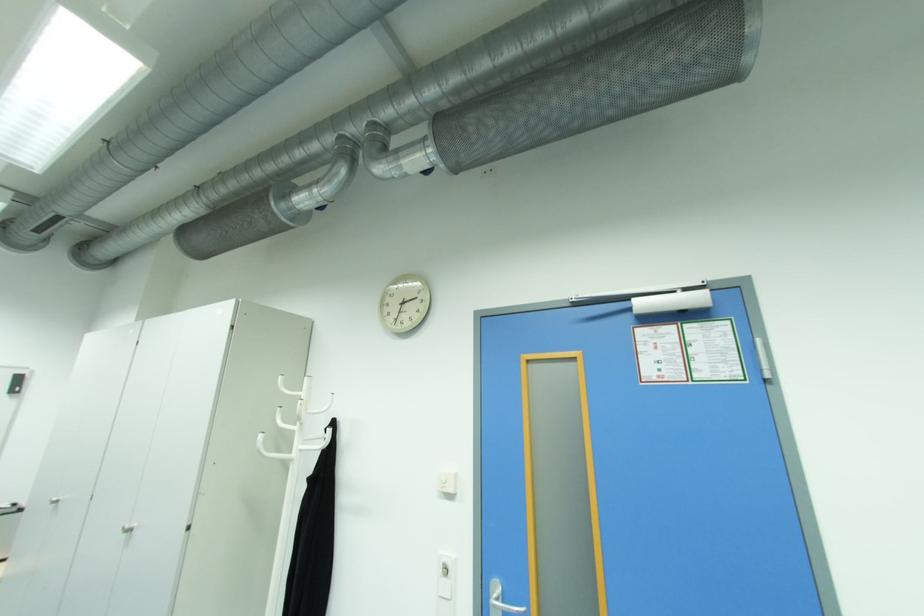
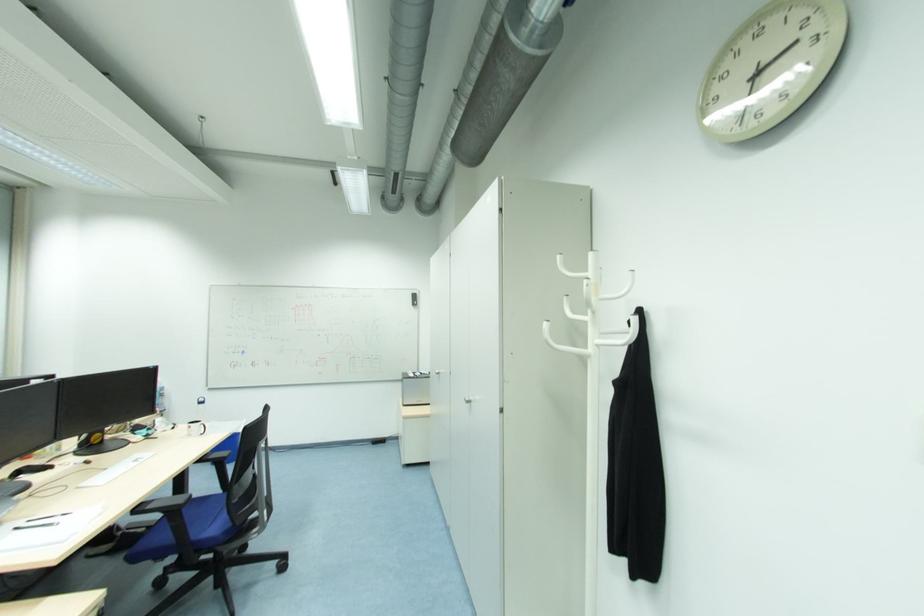
The point at (138, 527) is marked in the first image. Where is the corresponding point in the second image?

(473, 400)